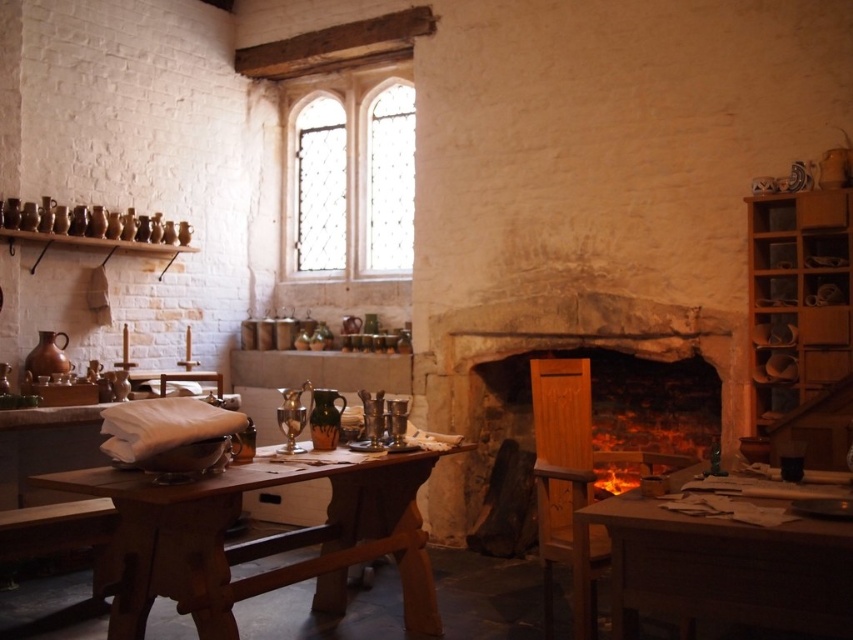
Question: Can you confirm if stone fireplace at center is smaller than wooden shelves at right?

Choices:
 (A) no
 (B) yes

Answer: (A)

Question: Does brown wooden table at lower left have a lesser width compared to stone fireplace at center?

Choices:
 (A) yes
 (B) no

Answer: (A)

Question: Which point is farther to the camera?

Choices:
 (A) (695, 516)
 (B) (769, 410)
 (C) (68, 486)

Answer: (B)

Question: Can you confirm if stone fireplace at center is positioned to the right of clear glass window at upper center?

Choices:
 (A) yes
 (B) no

Answer: (A)

Question: Which point is farther from the camera taking this photo?

Choices:
 (A) (703, 608)
 (B) (851, 250)
 (C) (471, 394)

Answer: (C)

Question: Which point is farther from the camera taking this photo?

Choices:
 (A) (286, 196)
 (B) (793, 614)

Answer: (A)